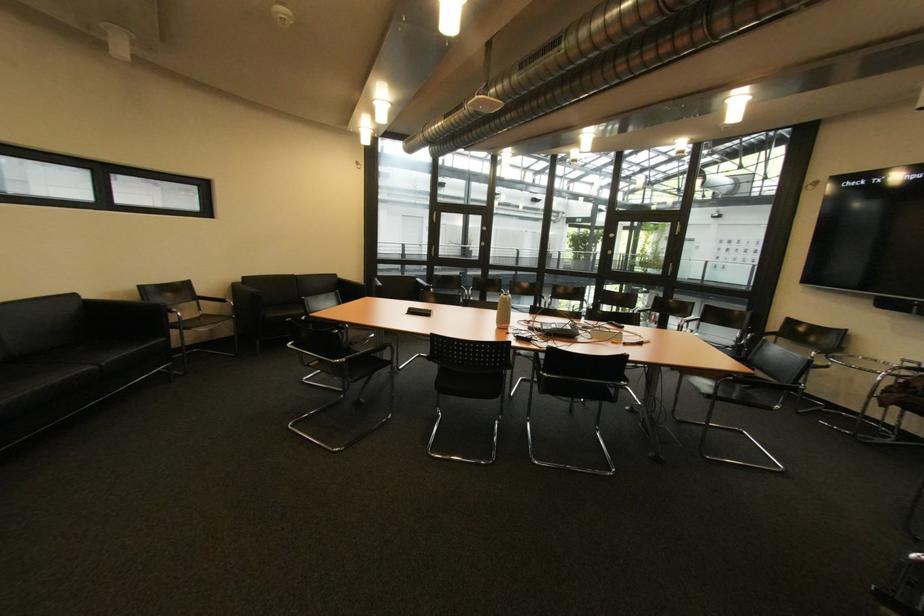
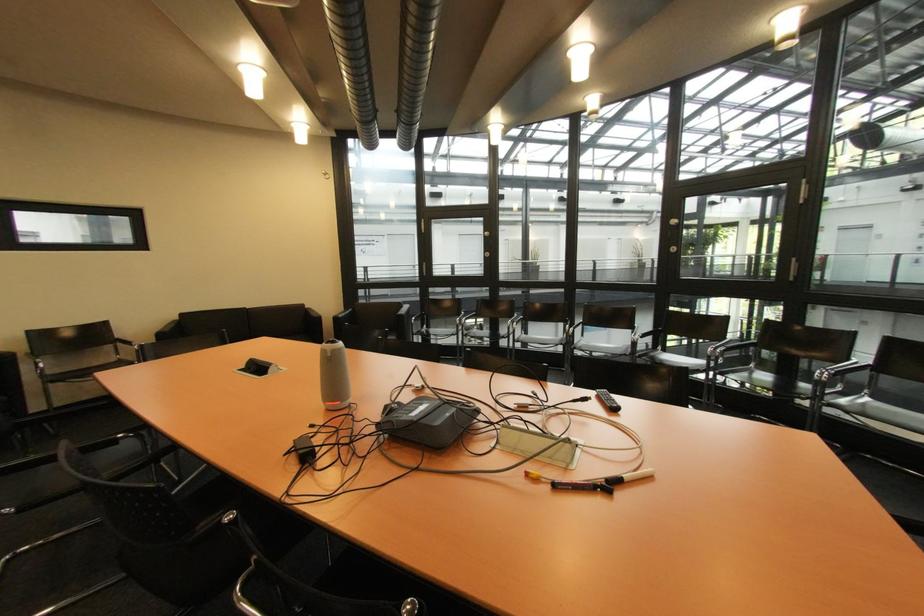
In a continuous first-person perspective shot, in which direction is the camera moving?

The movement direction of the cameraman is right, forward.